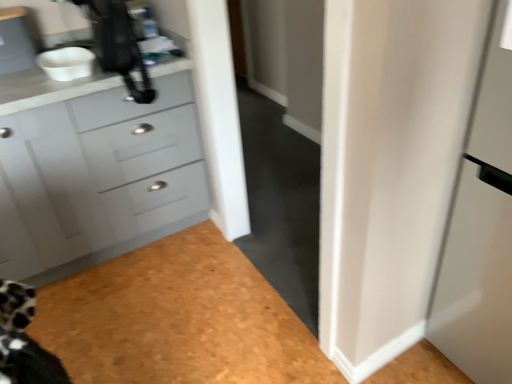
Question: Is black plastic coffee machine at upper left smaller than matte gray cabinet at left?

Choices:
 (A) yes
 (B) no

Answer: (A)

Question: From the image's perspective, is black plastic coffee machine at upper left above matte gray cabinet at left?

Choices:
 (A) yes
 (B) no

Answer: (A)

Question: Is black plastic coffee machine at upper left oriented towards matte gray cabinet at left?

Choices:
 (A) yes
 (B) no

Answer: (B)

Question: Is matte gray cabinet at left completely or partially inside black plastic coffee machine at upper left?

Choices:
 (A) no
 (B) yes

Answer: (A)

Question: Is the position of black plastic coffee machine at upper left less distant than that of matte gray cabinet at left?

Choices:
 (A) yes
 (B) no

Answer: (B)

Question: Considering the relative sizes of black plastic coffee machine at upper left and matte gray cabinet at left in the image provided, is black plastic coffee machine at upper left bigger than matte gray cabinet at left?

Choices:
 (A) yes
 (B) no

Answer: (B)

Question: From a real-world perspective, is black plastic coffee machine at upper left positioned over white glossy door at right based on gravity?

Choices:
 (A) no
 (B) yes

Answer: (B)

Question: From the image's perspective, is black plastic coffee machine at upper left below white glossy door at right?

Choices:
 (A) no
 (B) yes

Answer: (A)

Question: From a real-world perspective, does black plastic coffee machine at upper left sit lower than white glossy door at right?

Choices:
 (A) no
 (B) yes

Answer: (A)

Question: Is black plastic coffee machine at upper left not close to white glossy door at right?

Choices:
 (A) yes
 (B) no

Answer: (A)

Question: From the image's perspective, is black plastic coffee machine at upper left on white glossy door at right?

Choices:
 (A) no
 (B) yes

Answer: (B)

Question: Is black plastic coffee machine at upper left positioned with its back to white glossy door at right?

Choices:
 (A) yes
 (B) no

Answer: (B)

Question: Is white matte bowl at upper left looking in the opposite direction of matte gray cabinet at left?

Choices:
 (A) no
 (B) yes

Answer: (A)